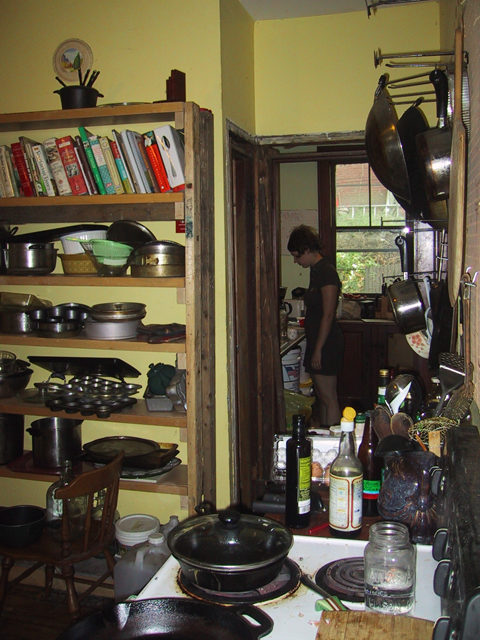
Find the location of `shelf`. shelf is located at coordinates (151, 284).